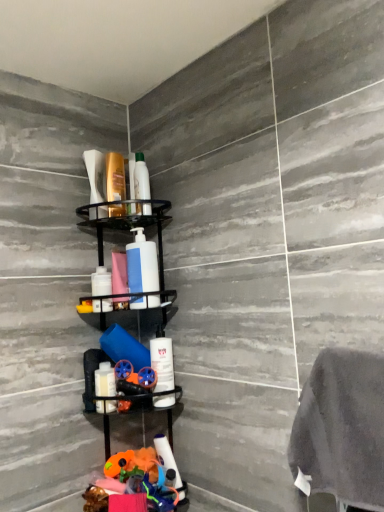
Question: Does white glossy bottle at lower left, marked as the 5th toiletry in a top-to-bottom arrangement, have a greater width compared to white matte bottle at center, which ranks as the 3th toiletry in bottom-to-top order?

Choices:
 (A) yes
 (B) no

Answer: (A)

Question: From the image's perspective, is white glossy bottle at lower left, marked as the 5th toiletry in a top-to-bottom arrangement, located beneath white matte bottle at center, which ranks as the 3th toiletry in bottom-to-top order?

Choices:
 (A) yes
 (B) no

Answer: (A)

Question: Does white glossy bottle at lower left, marked as the 5th toiletry in a top-to-bottom arrangement, have a lesser width compared to white matte bottle at center, the 3th toiletry viewed from the top?

Choices:
 (A) yes
 (B) no

Answer: (B)

Question: Is white glossy bottle at lower left, marked as the 5th toiletry in a top-to-bottom arrangement, bigger than white matte bottle at center, which ranks as the 3th toiletry in bottom-to-top order?

Choices:
 (A) yes
 (B) no

Answer: (A)

Question: Is white glossy bottle at lower left, marked as the 5th toiletry in a top-to-bottom arrangement, facing towards white matte bottle at center, the 3th toiletry viewed from the top?

Choices:
 (A) yes
 (B) no

Answer: (B)

Question: Does white glossy bottle at lower left, marked as the 5th toiletry in a top-to-bottom arrangement, come behind white matte bottle at center, the 3th toiletry viewed from the top?

Choices:
 (A) no
 (B) yes

Answer: (A)

Question: From a real-world perspective, is translucent plastic shampoo bottle at upper center, which is the 5th toiletry in bottom-to-top order, physically below white matte bottle at center, which is the fourth toiletry from top to bottom?

Choices:
 (A) yes
 (B) no

Answer: (B)

Question: From the image's perspective, would you say translucent plastic shampoo bottle at upper center, which is the 5th toiletry in bottom-to-top order, is shown under white matte bottle at center, which is the fourth toiletry from top to bottom?

Choices:
 (A) no
 (B) yes

Answer: (A)

Question: Does translucent plastic shampoo bottle at upper center, which is the 5th toiletry in bottom-to-top order, come in front of white matte bottle at center, which is the fourth toiletry from top to bottom?

Choices:
 (A) yes
 (B) no

Answer: (B)

Question: Is translucent plastic shampoo bottle at upper center, which is the 5th toiletry in bottom-to-top order, bigger than white matte bottle at center, the second toiletry from the bottom?

Choices:
 (A) no
 (B) yes

Answer: (B)

Question: Does translucent plastic shampoo bottle at upper center, which is the 1th toiletry in top-to-bottom order, come behind white matte bottle at center, the second toiletry from the bottom?

Choices:
 (A) yes
 (B) no

Answer: (A)

Question: From the image's perspective, is translucent plastic shampoo bottle at upper center, which is the 5th toiletry in bottom-to-top order, on white matte bottle at center, which is the fourth toiletry from top to bottom?

Choices:
 (A) yes
 (B) no

Answer: (A)

Question: Can you confirm if black matte shelf at center is shorter than white matte pump bottle at center?

Choices:
 (A) no
 (B) yes

Answer: (A)